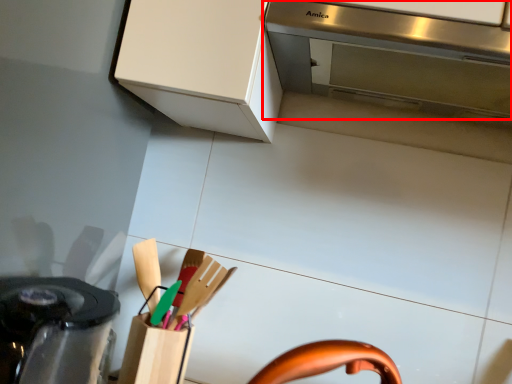
Question: From the image's perspective, what is the correct spatial positioning of home appliance (annotated by the red box) in reference to kitchen appliance?

Choices:
 (A) above
 (B) below

Answer: (A)